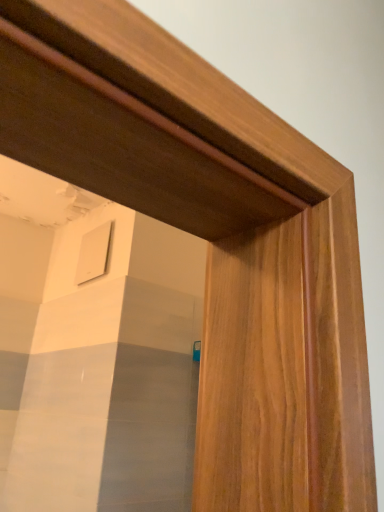
The height and width of the screenshot is (512, 384). What do you see at coordinates (93, 254) in the screenshot?
I see `white matte vent at upper center` at bounding box center [93, 254].

The width and height of the screenshot is (384, 512). Find the location of `white matte vent at upper center`. white matte vent at upper center is located at coordinates (93, 254).

I want to click on white matte vent at upper center, so click(93, 254).